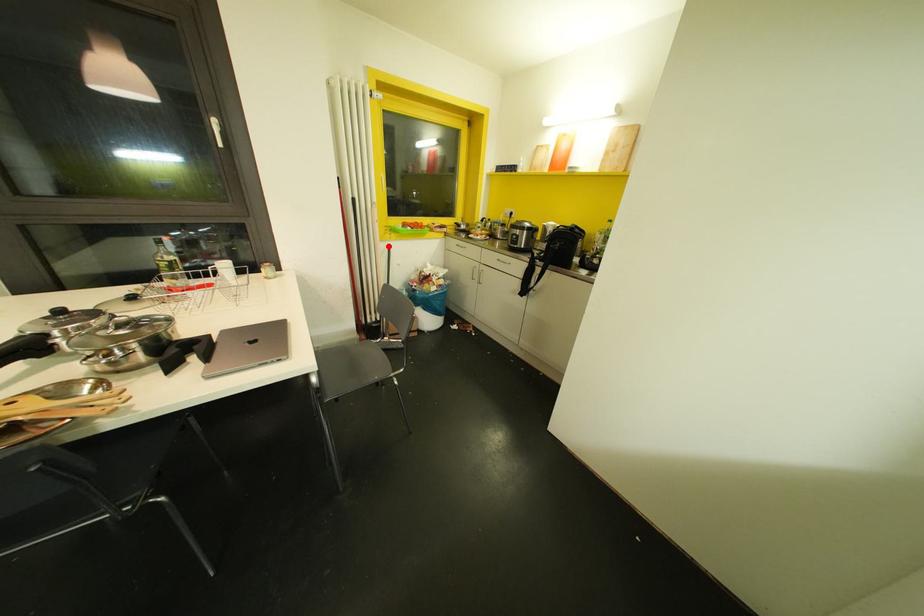
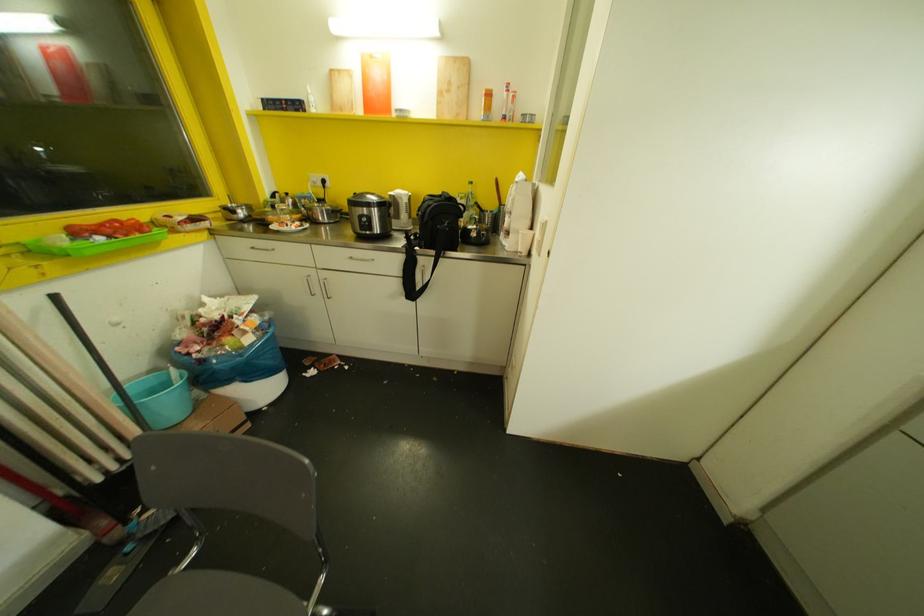
Question: I am providing you with two images of the same scene from different viewpoints. Given a red point in image1, look at the same physical point in image2. Is it:

Choices:
 (A) Closer to the viewpoint
 (B) Farther from the viewpoint

Answer: (B)